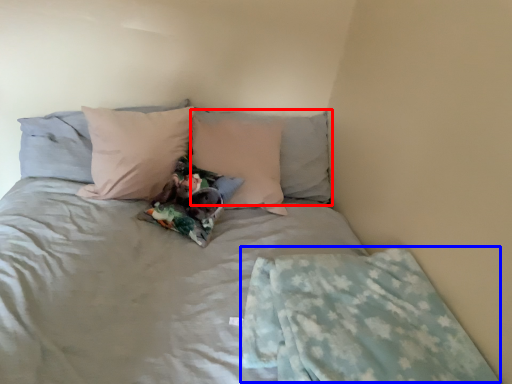
Question: Which object is further to the camera taking this photo, pillow (highlighted by a red box) or blanket (highlighted by a blue box)?

Choices:
 (A) pillow
 (B) blanket

Answer: (A)